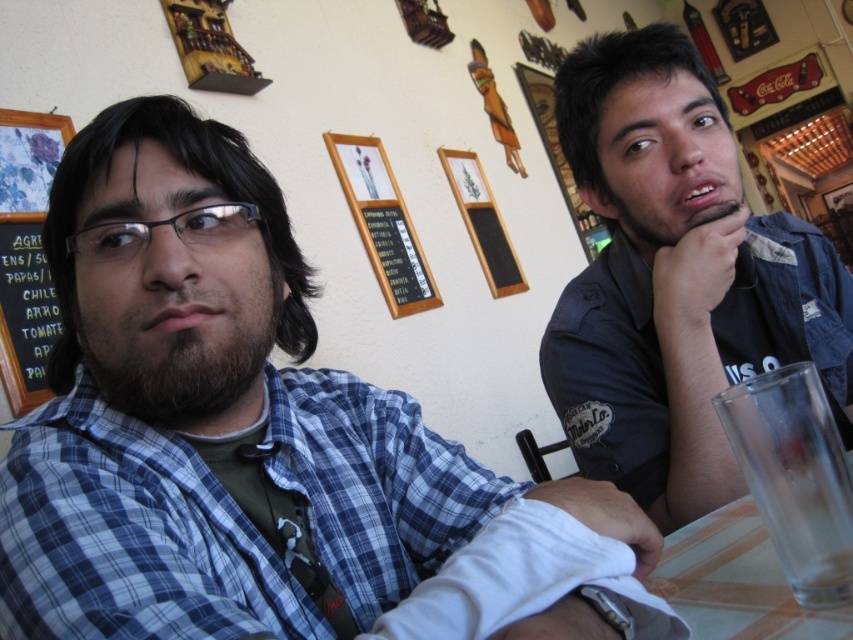
From the picture: Between blue plaid shirt at left and transparent glass at lower right, which one appears on the left side from the viewer's perspective?

blue plaid shirt at left is more to the left.

Is point (372, 502) positioned behind point (848, 541)?

Yes, it is behind point (848, 541).

Which is in front, point (219, 467) or point (804, 541)?

Point (804, 541) is more forward.

Locate an element on the screen. The width and height of the screenshot is (853, 640). blue plaid shirt at left is located at coordinates (259, 442).

Between blue plaid shirt at left and dark blue shirt at right, which one is positioned lower?

blue plaid shirt at left

What do you see at coordinates (259, 442) in the screenshot? I see `blue plaid shirt at left` at bounding box center [259, 442].

Which is in front, point (456, 589) or point (831, 321)?

Point (456, 589) is in front.

Where is `blue plaid shirt at left`? The image size is (853, 640). blue plaid shirt at left is located at coordinates [x=259, y=442].

Is dark blue shirt at right to the right of black chalkboard at left from the viewer's perspective?

Indeed, dark blue shirt at right is positioned on the right side of black chalkboard at left.

Between dark blue shirt at right and black chalkboard at left, which one appears on the right side from the viewer's perspective?

dark blue shirt at right

Where is `dark blue shirt at right`? dark blue shirt at right is located at coordinates (676, 280).